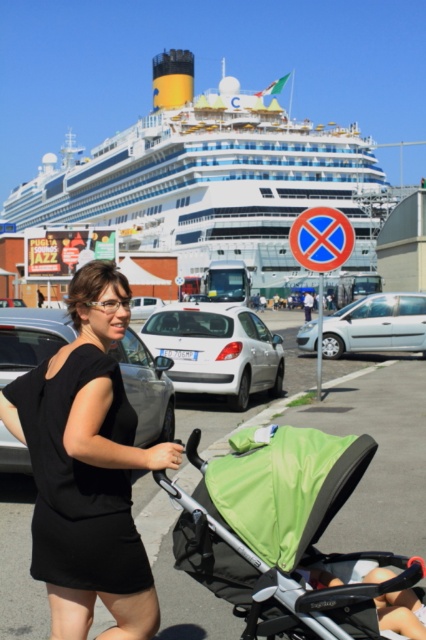
You are standing at the position of the woman with the stroller and want to see the white glossy cruise ship at upper center. In which direction should you look?

You should look towards the upper center direction to see the white glossy cruise ship at upper center.

You are a pedestrian standing at the port area. You see a black fabric dress at center and a light blue metallic car at center. Which object is narrower?

The black fabric dress at center is narrower than the light blue metallic car at center.

Looking at this image, you are a photographer trying to capture the entire white glossy cruise ship at upper center and the black fabric dress at center in one frame. Which object should you focus on first to ensure both are in the frame?

The white glossy cruise ship at upper center is larger than the black fabric dress at center, so you should focus on the cruise ship first to ensure both fit in the frame.